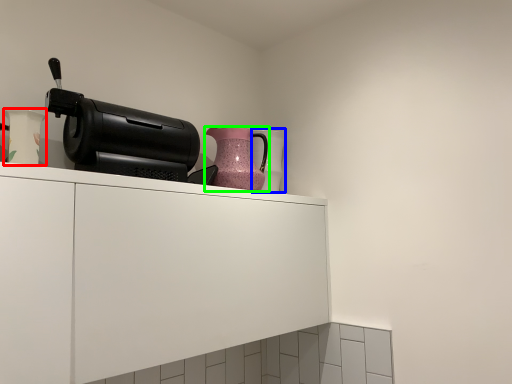
Question: Considering the real-world distances, which object is farthest from vase (highlighted by a red box)? vase (highlighted by a blue box) or jug (highlighted by a green box)?

Choices:
 (A) vase
 (B) jug

Answer: (A)